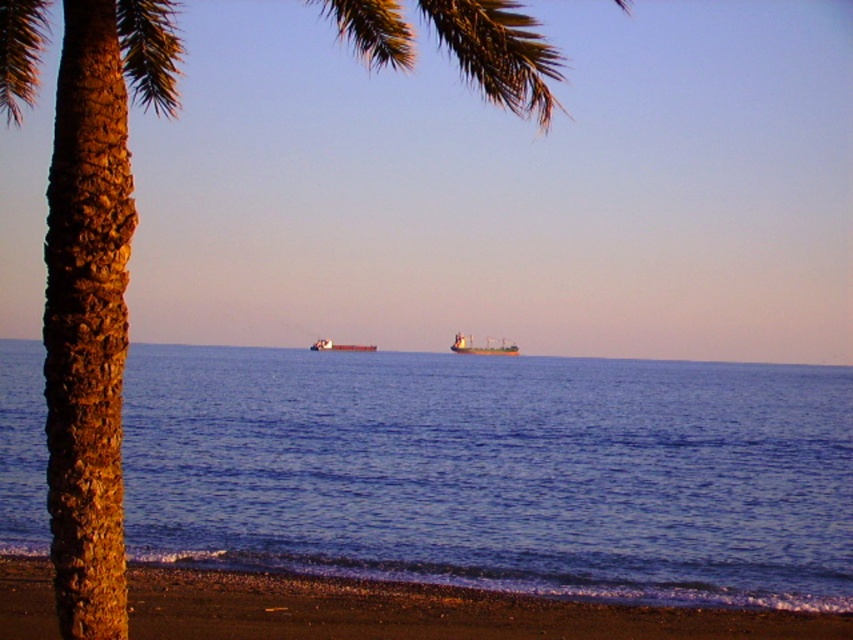
Can you confirm if blue water at center is bigger than brown textured palm tree at left?

No.

Does point (682, 480) come behind point (103, 362)?

Yes, point (682, 480) is farther from viewer.

Locate an element on the screen. blue water at center is located at coordinates point(497,472).

Is the position of brown textured palm tree at left less distant than that of brown matte cargo ship at center?

That is True.

Is brown textured palm tree at left further to camera compared to brown matte cargo ship at center?

No, brown textured palm tree at left is closer to the viewer.

This screenshot has width=853, height=640. What do you see at coordinates (94, 292) in the screenshot?
I see `brown textured palm tree at left` at bounding box center [94, 292].

The image size is (853, 640). Find the location of `brown textured palm tree at left`. brown textured palm tree at left is located at coordinates (94, 292).

Who is positioned more to the right, metallic gray cargo ship at center or brown matte cargo ship at center?

Positioned to the right is metallic gray cargo ship at center.

Is metallic gray cargo ship at center closer to the viewer compared to brown matte cargo ship at center?

Yes, it is.

Between point (492, 353) and point (321, 346), which one is positioned behind?

Point (321, 346)

Find the location of a particular element. metallic gray cargo ship at center is located at coordinates (480, 346).